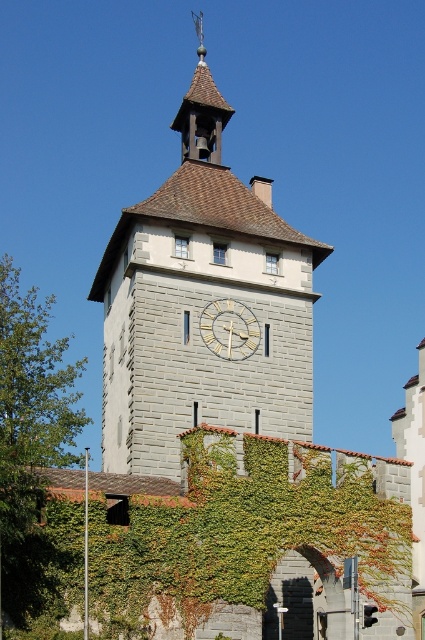
You are standing in front of the historic stone tower and notice both the gray stone clock tower at center and the green ivy at center. Which object is positioned more to the left side of the scene?

The gray stone clock tower at center is positioned to the left of the green ivy at center, so it is more to the left side of the scene.

You are a painter planning to paint the historic stone tower. You need to know which object at the center is wider to decide where to focus your brushstrokes. Which is wider, the green ivy at center or the white wooden clock at center?

The green ivy at center might be wider than the white wooden clock at center according to the description, so the painter should focus more on the area where the green ivy at center is located since it could be wider.

You are standing in front of the historic stone tower. You notice the gray stone clock tower at center and the green ivy at center. Which object is closer to you?

The gray stone clock tower at center is closer to you because the green ivy at center is behind it.